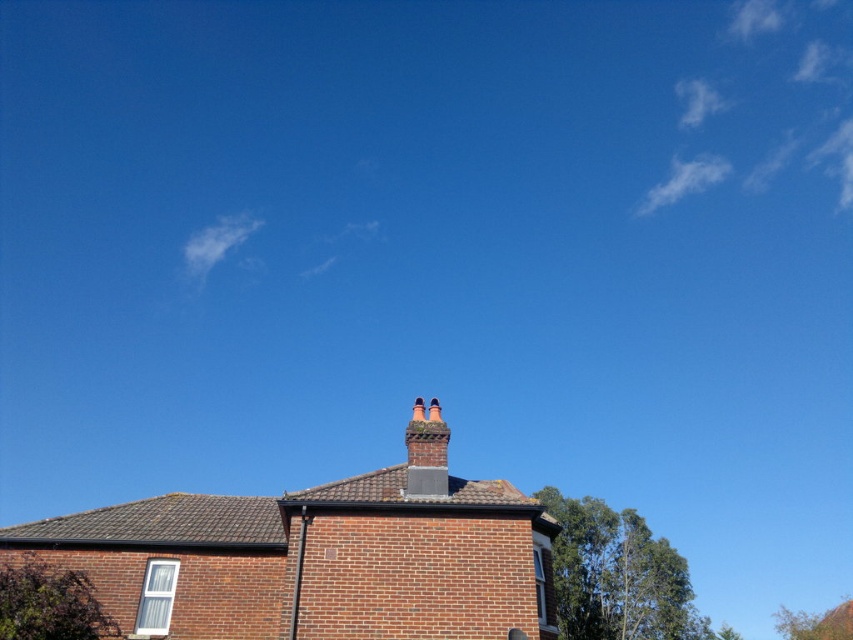
In the scene shown: Does green leafy tree at upper right appear on the right side of red brick chimney at center?

Yes, green leafy tree at upper right is to the right of red brick chimney at center.

Can you confirm if green leafy tree at upper right is bigger than red brick chimney at center?

Yes, green leafy tree at upper right is bigger than red brick chimney at center.

At what (x,y) coordinates should I click in order to perform the action: click on green leafy tree at upper right. Please return your answer as a coordinate pair (x, y). The height and width of the screenshot is (640, 853). Looking at the image, I should click on (618, 576).

You are a GUI agent. You are given a task and a screenshot of the screen. Output one action in this format:
    pyautogui.click(x=<x>, y=<y>)
    Task: Click on the green leafy tree at upper right
    The image size is (853, 640).
    Given the screenshot: What is the action you would take?
    pyautogui.click(x=618, y=576)

Who is positioned more to the left, red brick chimney at center or green leafy tree at lower right?

From the viewer's perspective, red brick chimney at center appears more on the left side.

Between point (419, 458) and point (804, 628), which one is positioned behind?

The point (804, 628) is more distant.

I want to click on red brick chimney at center, so click(x=426, y=451).

Locate an element on the screen. red brick chimney at center is located at coordinates (426, 451).

Between green leafy tree at upper right and green leafy tree at lower right, which one appears on the right side from the viewer's perspective?

From the viewer's perspective, green leafy tree at lower right appears more on the right side.

Is green leafy tree at upper right shorter than green leafy tree at lower right?

Yes.

Is point (578, 515) less distant than point (848, 630)?

Yes, point (578, 515) is closer to viewer.

Find the location of a particular element. The width and height of the screenshot is (853, 640). green leafy tree at upper right is located at coordinates (618, 576).